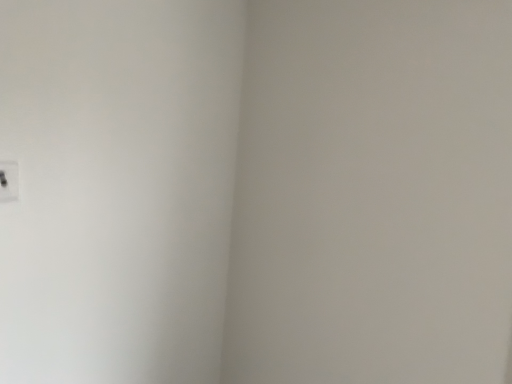
What is the approximate width of black plastic power plugs and sockets at lower left?

1.63 centimeters.

Describe the element at coordinates (9, 181) in the screenshot. I see `black plastic power plugs and sockets at lower left` at that location.

Find the location of `black plastic power plugs and sockets at lower left`. black plastic power plugs and sockets at lower left is located at coordinates (9, 181).

The image size is (512, 384). I want to click on black plastic power plugs and sockets at lower left, so click(x=9, y=181).